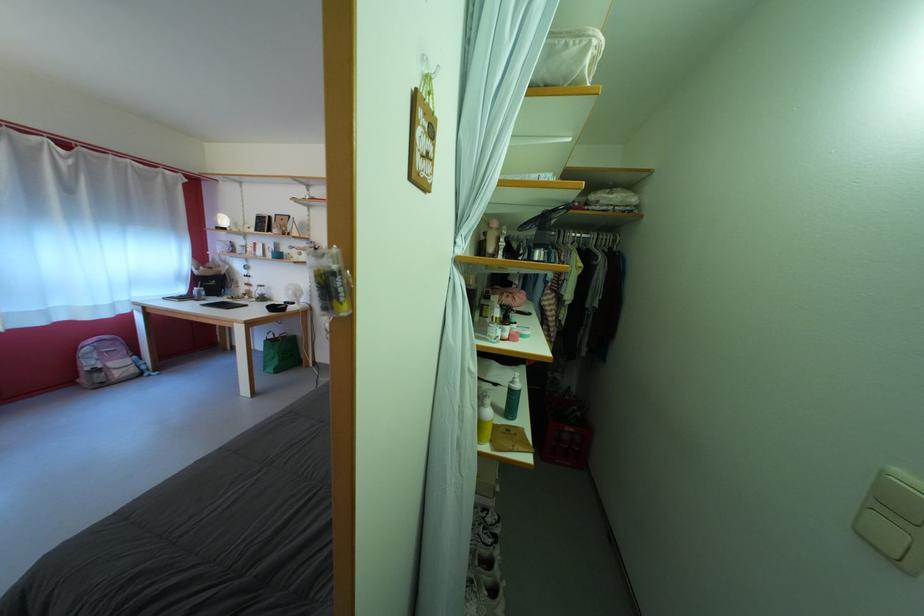
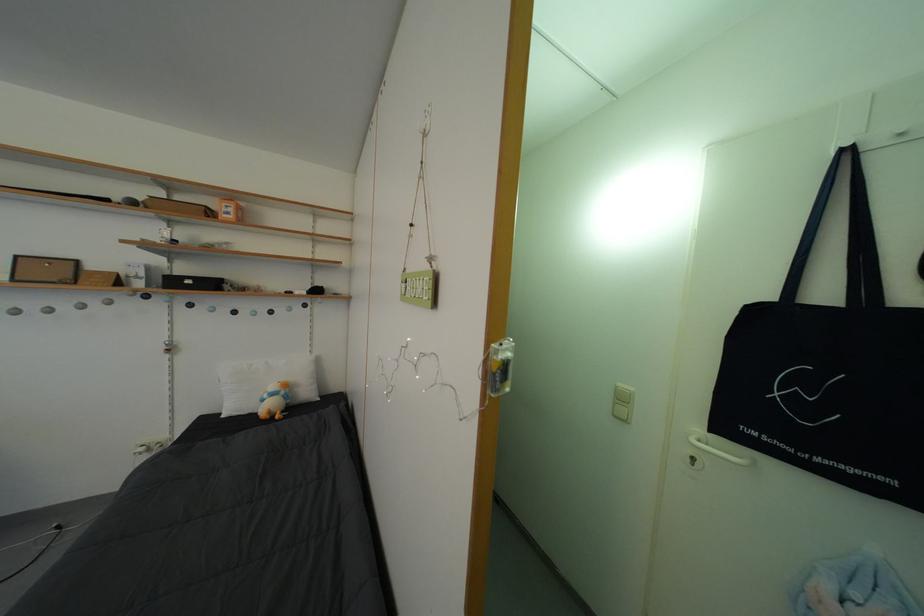
Question: How did the camera likely rotate?

Choices:
 (A) Left
 (B) Right
 (C) Up
 (D) Down

Answer: (B)